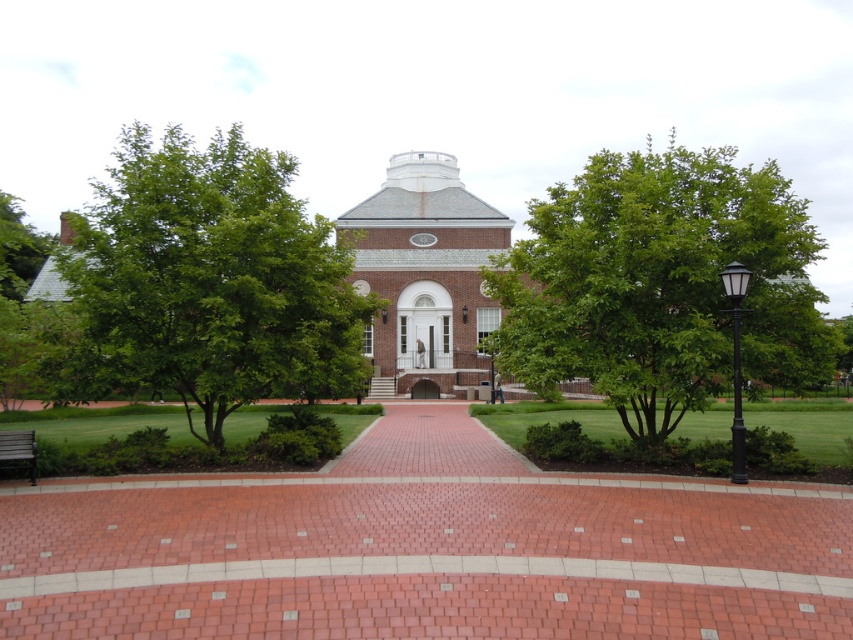
Is brick at center below brick building at center?

Correct, brick at center is located below brick building at center.

Does point (672, 563) come closer to viewer compared to point (440, 173)?

Yes, point (672, 563) is closer to viewer.

At what (x,y) coordinates should I click in order to perform the action: click on brick at center. Please return your answer as a coordinate pair (x, y). The height and width of the screenshot is (640, 853). Looking at the image, I should click on (425, 550).

Is point (344, 273) positioned in front of point (502, 225)?

Yes, point (344, 273) is closer to viewer.

This screenshot has height=640, width=853. Describe the element at coordinates (212, 280) in the screenshot. I see `green leafy tree at left` at that location.

Locate an element on the screen. green leafy tree at left is located at coordinates (212, 280).

Between brick at center and green leafy tree at center, which one appears on the left side from the viewer's perspective?

brick at center

Measure the distance between brick at center and green leafy tree at center.

The distance of brick at center from green leafy tree at center is 19.86 meters.

This screenshot has width=853, height=640. Find the location of `brick at center`. brick at center is located at coordinates (425, 550).

Locate an element on the screen. The image size is (853, 640). brick at center is located at coordinates (425, 550).